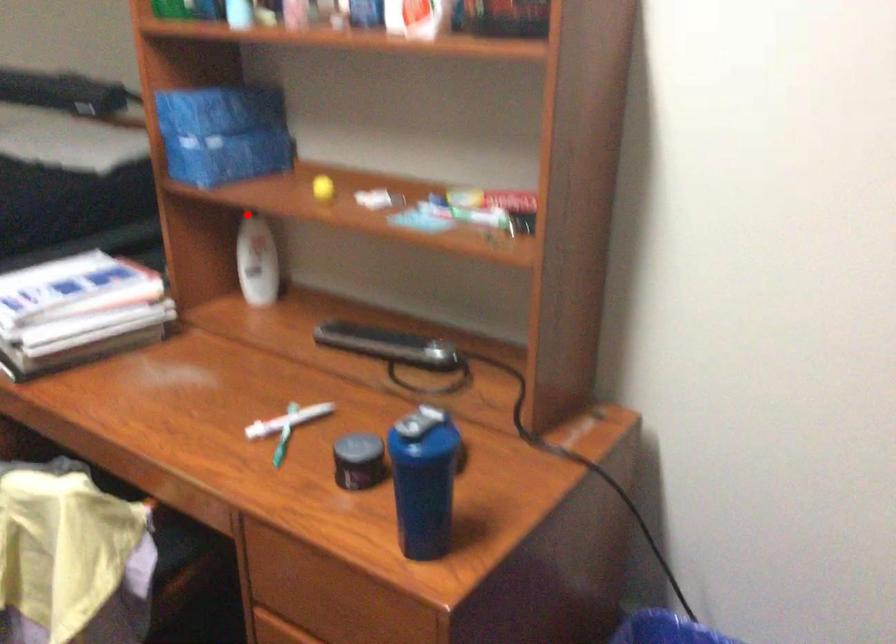
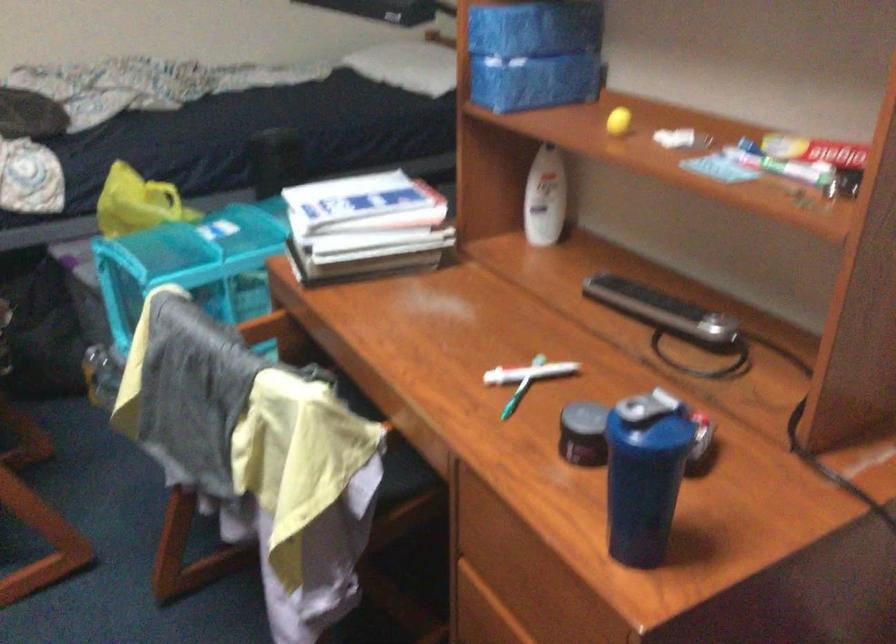
Locate, in the second image, the point that corresponds to the highlighted location in the first image.

(541, 147)